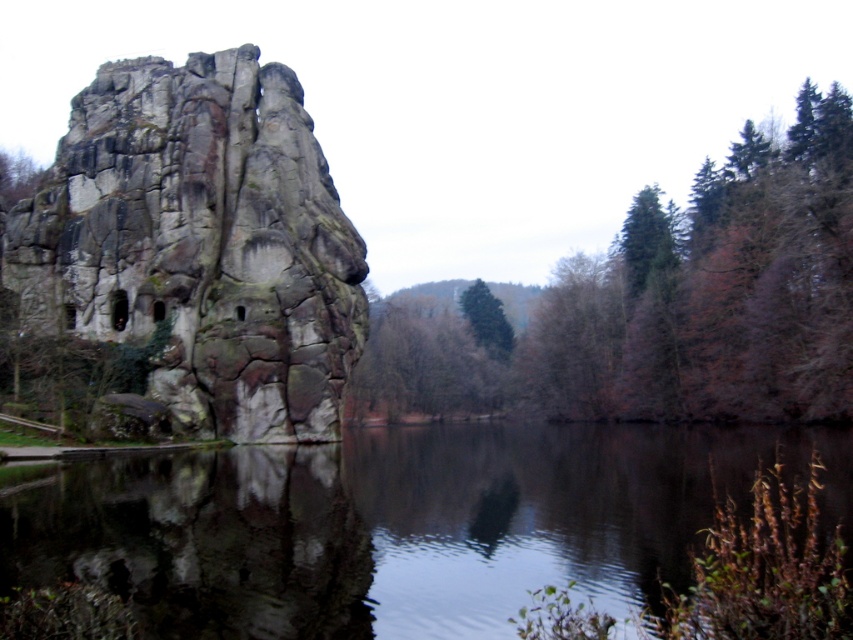
Which is in front, point (231, 301) or point (534, 380)?

Positioned in front is point (231, 301).

Image resolution: width=853 pixels, height=640 pixels. What do you see at coordinates (201, 243) in the screenshot? I see `rough stone rock formation at left` at bounding box center [201, 243].

Locate an element on the screen. The image size is (853, 640). rough stone rock formation at left is located at coordinates (201, 243).

Can you confirm if dark reflective water at center is positioned below smooth brown tree at right?

Correct, dark reflective water at center is located below smooth brown tree at right.

Is dark reflective water at center thinner than smooth brown tree at right?

Indeed, dark reflective water at center has a lesser width compared to smooth brown tree at right.

Find the location of a particular element. Image resolution: width=853 pixels, height=640 pixels. dark reflective water at center is located at coordinates [x=399, y=524].

This screenshot has height=640, width=853. I want to click on dark reflective water at center, so click(x=399, y=524).

Who is more distant from viewer, (439, 588) or (227, 413)?

Point (227, 413)

What do you see at coordinates (399, 524) in the screenshot? This screenshot has width=853, height=640. I see `dark reflective water at center` at bounding box center [399, 524].

Image resolution: width=853 pixels, height=640 pixels. What are the coordinates of `dark reflective water at center` in the screenshot? It's located at coord(399,524).